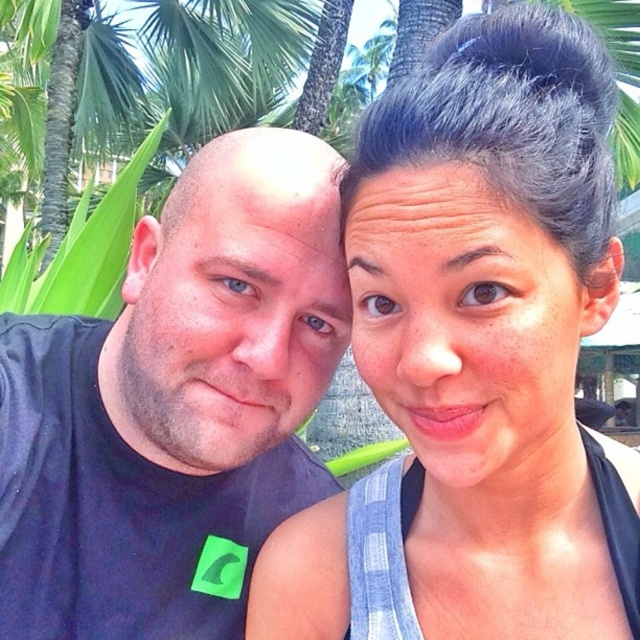
Is blue plaid shirt at upper right bigger than matte skin face at left?

Indeed, blue plaid shirt at upper right has a larger size compared to matte skin face at left.

Is blue plaid shirt at upper right below matte skin face at left?

Correct, blue plaid shirt at upper right is located below matte skin face at left.

Between point (516, 161) and point (307, 404), which one is positioned behind?

Positioned behind is point (307, 404).

At what (x,y) coordinates should I click in order to perform the action: click on blue plaid shirt at upper right. Please return your answer as a coordinate pair (x, y). This screenshot has width=640, height=640. Looking at the image, I should click on (476, 358).

Is point (408, 228) closer to viewer compared to point (237, 145)?

Yes, point (408, 228) is closer to viewer.

Is smooth skin face at center shorter than smooth bald head at center?

In fact, smooth skin face at center may be taller than smooth bald head at center.

What do you see at coordinates (465, 326) in the screenshot? I see `smooth skin face at center` at bounding box center [465, 326].

You are a GUI agent. You are given a task and a screenshot of the screen. Output one action in this format:
    pyautogui.click(x=<x>, y=<y>)
    Task: Click on the smooth skin face at center
    This screenshot has width=640, height=640.
    Given the screenshot: What is the action you would take?
    pyautogui.click(x=465, y=326)

Which of these two, blue plaid shirt at upper right or smooth skin face at center, stands taller?

With more height is blue plaid shirt at upper right.

The height and width of the screenshot is (640, 640). Find the location of `blue plaid shirt at upper right`. blue plaid shirt at upper right is located at coordinates (476, 358).